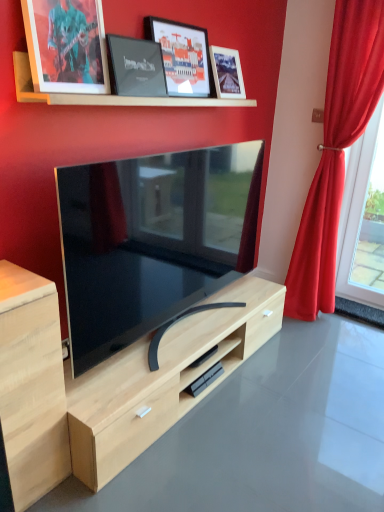
Where is `empty space that is ontop of light wood dresser at center`? Image resolution: width=384 pixels, height=512 pixels. empty space that is ontop of light wood dresser at center is located at coordinates (302, 412).